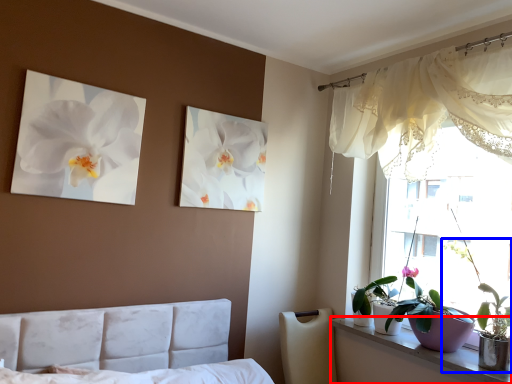
Question: Which of the following is the farthest to the observer, window sill (highlighted by a red box) or houseplant (highlighted by a blue box)?

Choices:
 (A) window sill
 (B) houseplant

Answer: (B)